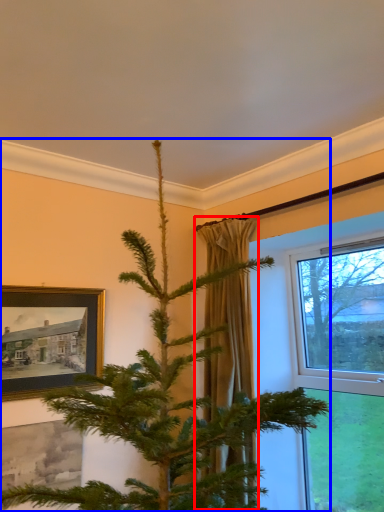
Question: Which point is further to the camera, curtain (highlighted by a red box) or christmas tree (highlighted by a blue box)?

Choices:
 (A) curtain
 (B) christmas tree

Answer: (A)